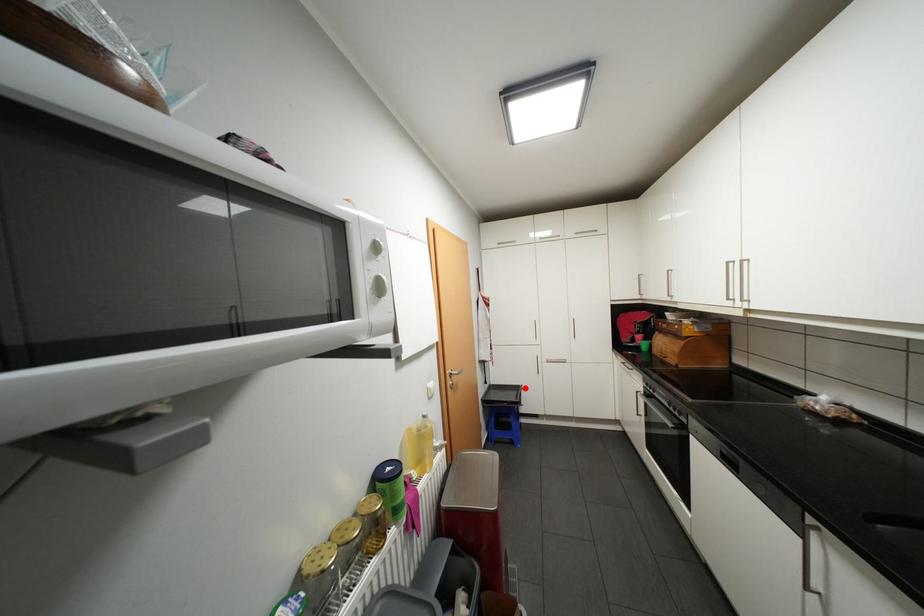
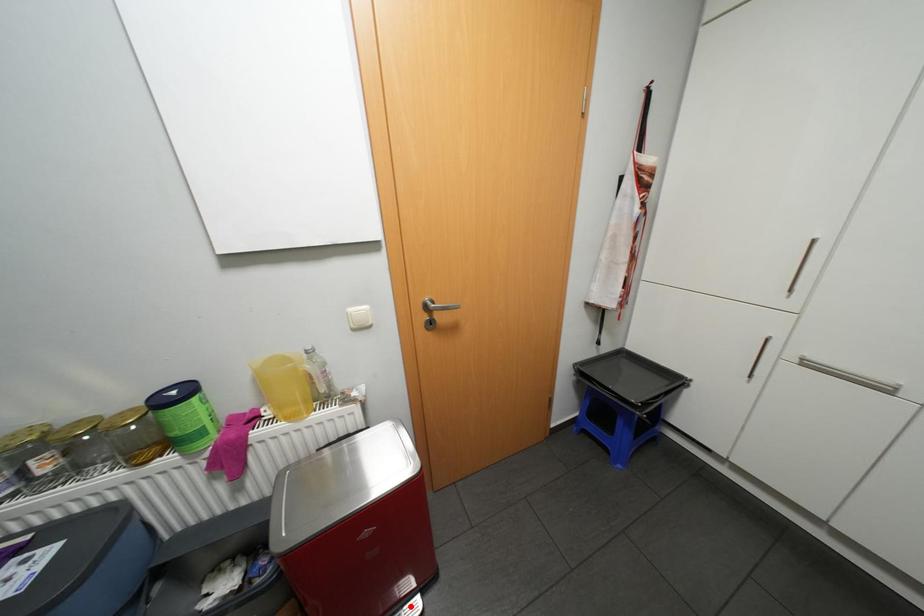
I am providing you with two images of the same scene from different viewpoints. A red point is marked on the first image and another point is marked on the second image. Does the point marked in image1 correspond to the same location as the one in image2?

No